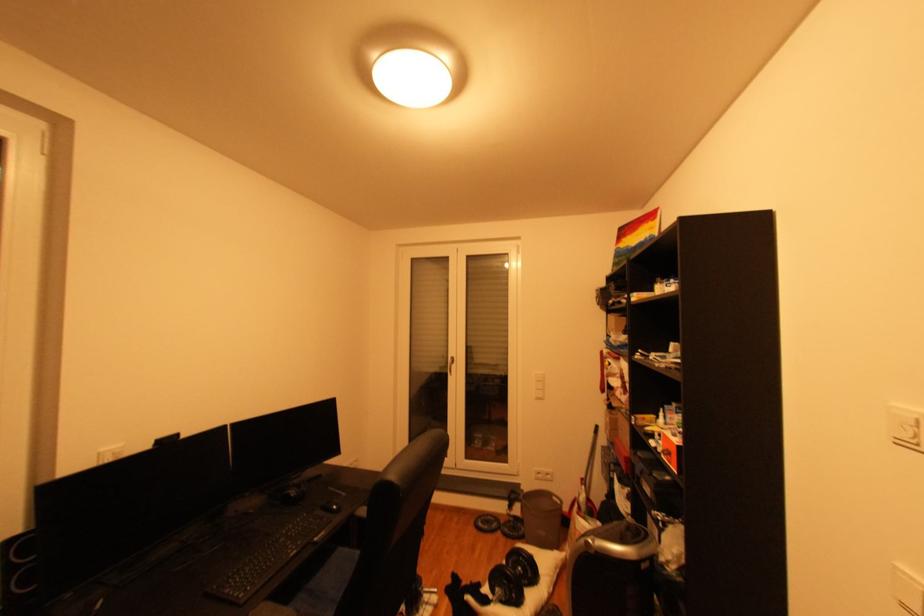
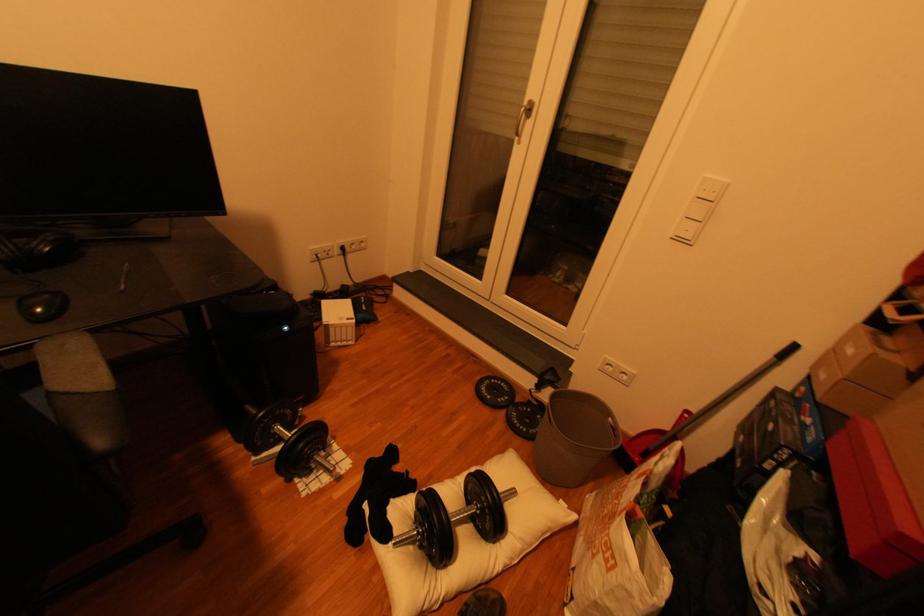
Find the pixel in the second image that matches (531,533) in the first image.

(543, 431)